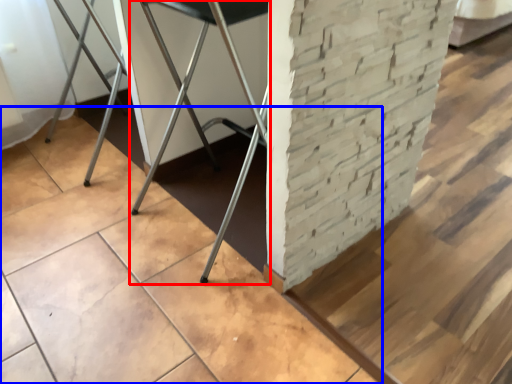
Question: Which object appears farthest to the camera in this image, furniture (highlighted by a red box) or concrete (highlighted by a blue box)?

Choices:
 (A) furniture
 (B) concrete

Answer: (A)